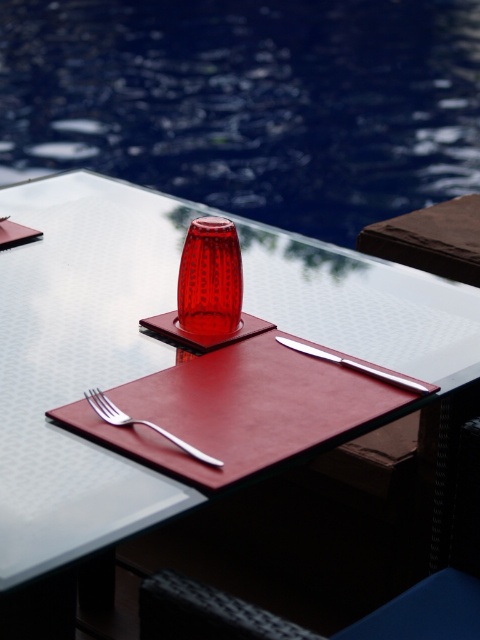
Question: Is the position of satin silver fork at lower left more distant than that of polished metal knife at center?

Choices:
 (A) yes
 (B) no

Answer: (B)

Question: Which of the following is the farthest from the observer?

Choices:
 (A) (420, 385)
 (B) (127, 416)
 (C) (28, 304)

Answer: (C)

Question: Based on their relative distances, which object is nearer to the metallic silver knife at upper center?

Choices:
 (A) satin silver fork at lower left
 (B) polished metal knife at center

Answer: (B)

Question: In this image, where is metallic silver knife at upper center located relative to polished metal knife at center?

Choices:
 (A) right
 (B) left

Answer: (B)

Question: Does metallic silver knife at upper center have a larger size compared to satin silver fork at lower left?

Choices:
 (A) no
 (B) yes

Answer: (B)

Question: Which point appears closest to the camera in this image?

Choices:
 (A) [x=336, y=355]
 (B) [x=157, y=432]
 (C) [x=294, y=282]

Answer: (B)